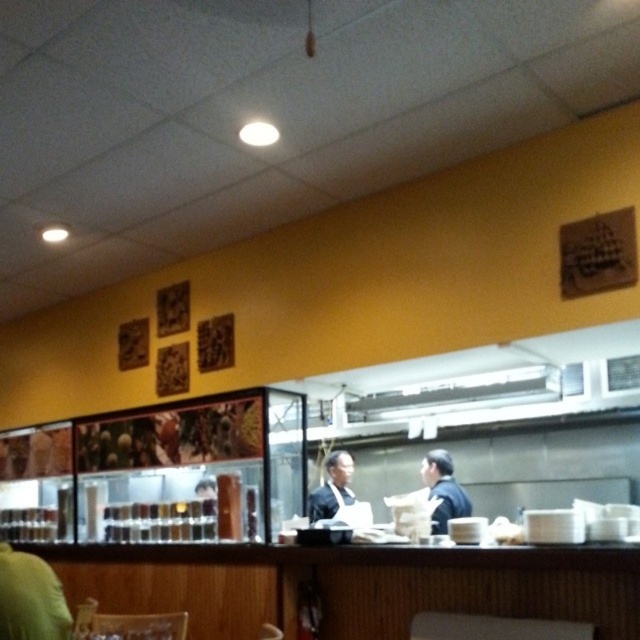
Question: Among these points, which one is farthest from the camera?

Choices:
 (A) (310, 500)
 (B) (445, 481)

Answer: (A)

Question: Among these objects, which one is farthest from the camera?

Choices:
 (A) dark blue suit at center
 (B) dark blue uniform at center

Answer: (A)

Question: Is dark blue uniform at center to the right of dark blue suit at center from the viewer's perspective?

Choices:
 (A) no
 (B) yes

Answer: (B)

Question: Among these objects, which one is farthest from the camera?

Choices:
 (A) dark blue uniform at center
 (B) dark blue suit at center

Answer: (B)

Question: Is dark blue uniform at center smaller than dark blue suit at center?

Choices:
 (A) no
 (B) yes

Answer: (A)

Question: Is dark blue uniform at center above dark blue suit at center?

Choices:
 (A) no
 (B) yes

Answer: (B)